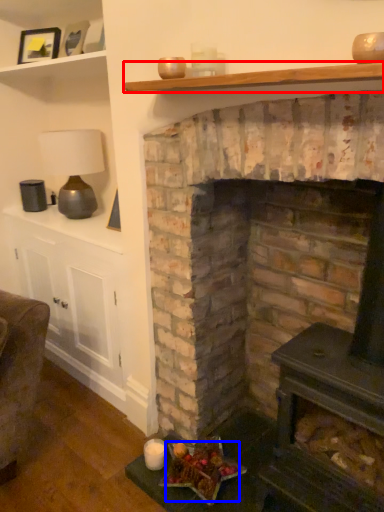
Question: Among these objects, which one is farthest to the camera, shelf (highlighted by a red box) or food (highlighted by a blue box)?

Choices:
 (A) shelf
 (B) food

Answer: (B)